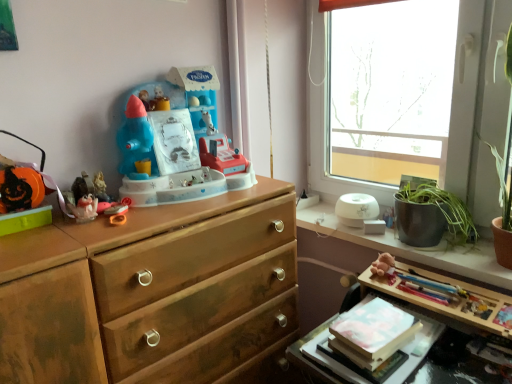
Image resolution: width=512 pixels, height=384 pixels. Identify the location of blank space situated above wooden table at lower right (from a real-world perspective). (442, 285).